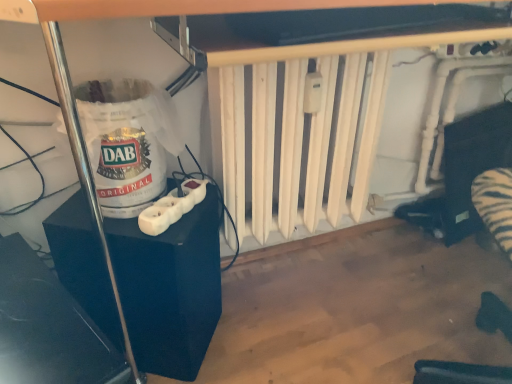
Question: Would you say black plastic power strip at left is to the left or to the right of white plastic wii controller at lower left in the picture?

Choices:
 (A) right
 (B) left

Answer: (B)

Question: Is black plastic power strip at left inside or outside of white plastic wii controller at lower left?

Choices:
 (A) inside
 (B) outside

Answer: (B)

Question: Estimate the real-world distances between objects in this image. Which object is closer to the white plastic wii controller at lower left?

Choices:
 (A) white paper bag at left
 (B) black plastic power strip at left
 (C) glossy plastic speaker at lower left
 (D) white matte radiator at center

Answer: (A)

Question: Based on their relative distances, which object is farther from the white paper bag at left?

Choices:
 (A) black plastic power strip at left
 (B) glossy plastic speaker at lower left
 (C) white plastic wii controller at lower left
 (D) white matte radiator at center

Answer: (D)